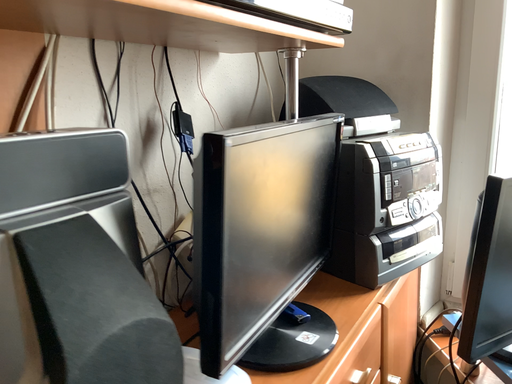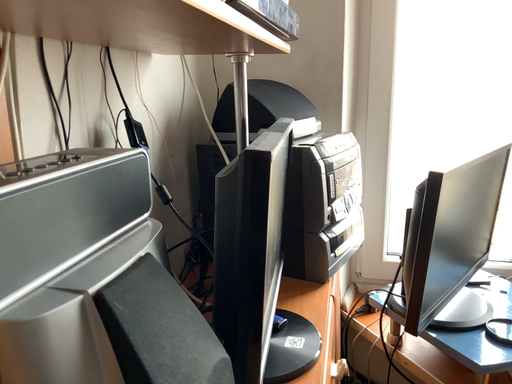
Question: Which way did the camera rotate in the video?

Choices:
 (A) rotated left
 (B) rotated right

Answer: (B)